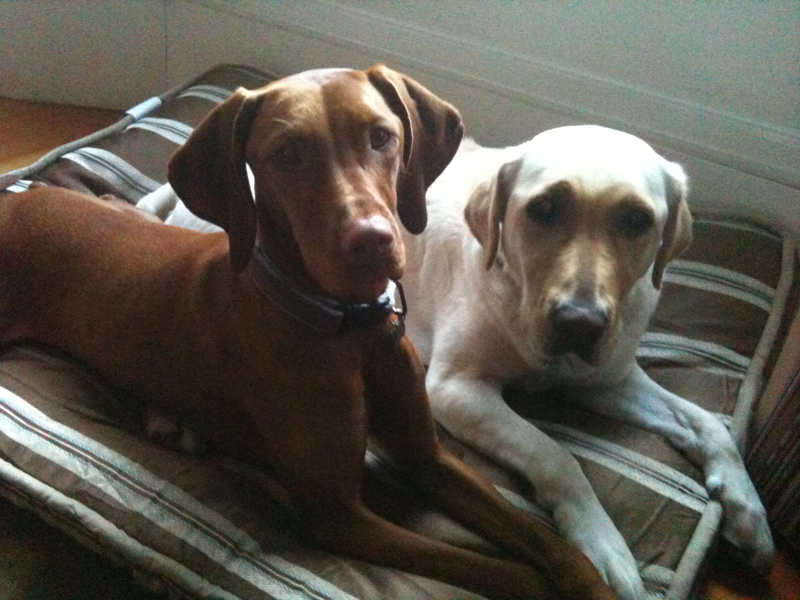
This screenshot has height=600, width=800. What are the coordinates of `brown floor` in the screenshot? It's located at (46, 125).